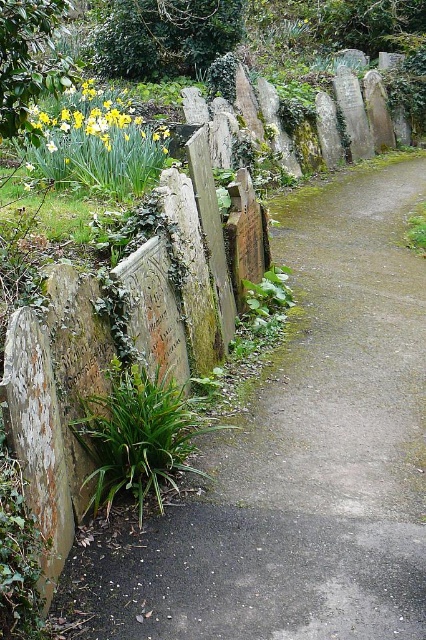
Question: Is smooth stone path at center smaller than yellow matte daffodil at upper left?

Choices:
 (A) no
 (B) yes

Answer: (B)

Question: Which point is farther to the camera?

Choices:
 (A) (154, 128)
 (B) (357, 500)

Answer: (A)

Question: Does smooth stone path at center lie behind yellow matte daffodil at upper left?

Choices:
 (A) yes
 (B) no

Answer: (B)

Question: Observing the image, what is the correct spatial positioning of smooth stone path at center in reference to yellow matte daffodil at upper left?

Choices:
 (A) above
 (B) below

Answer: (B)

Question: Among these objects, which one is nearest to the camera?

Choices:
 (A) yellow matte daffodil at upper left
 (B) smooth stone path at center

Answer: (B)

Question: Which of the following is the closest to the observer?

Choices:
 (A) (380, 413)
 (B) (117, 102)

Answer: (A)